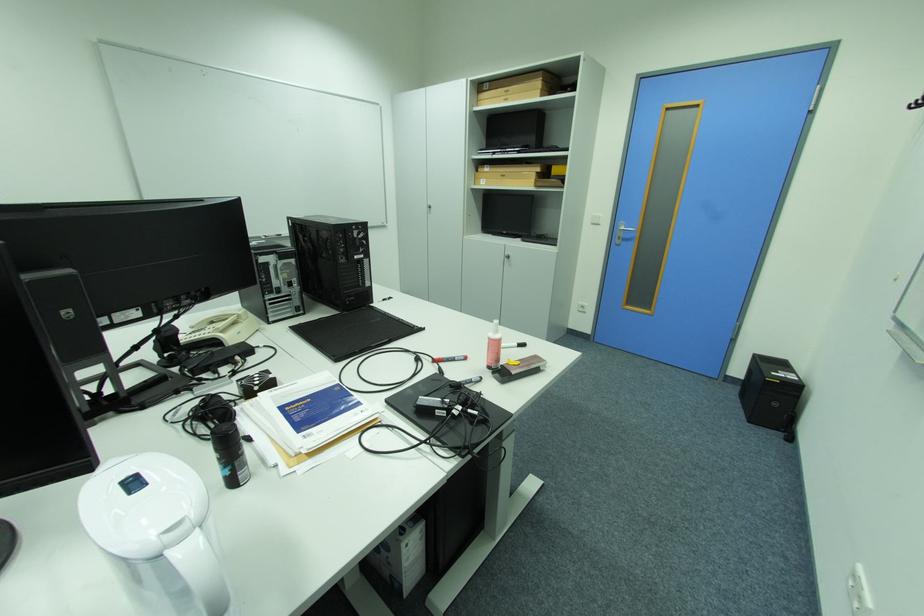
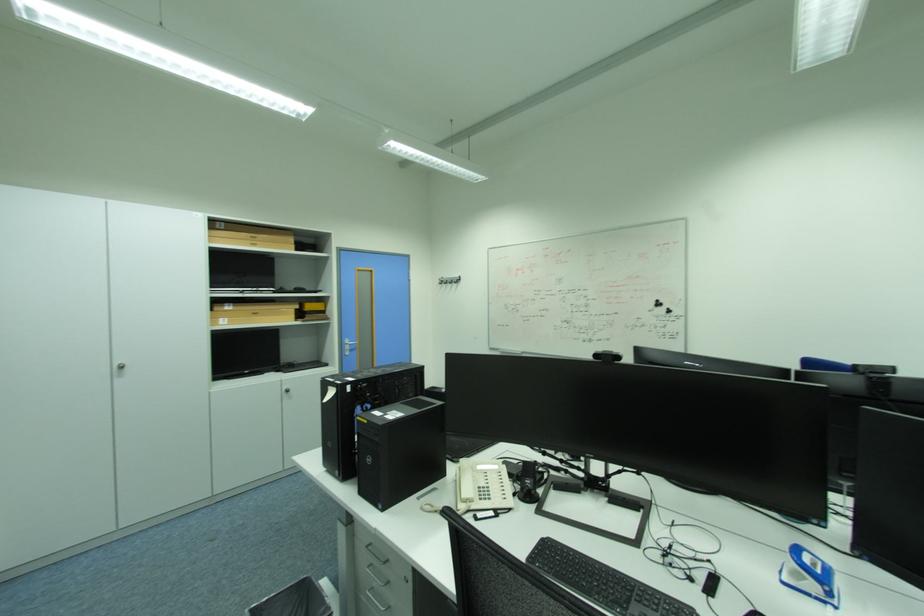
Where in the second image is the point corresponding to pixel 490 180 from the first image?

(228, 320)